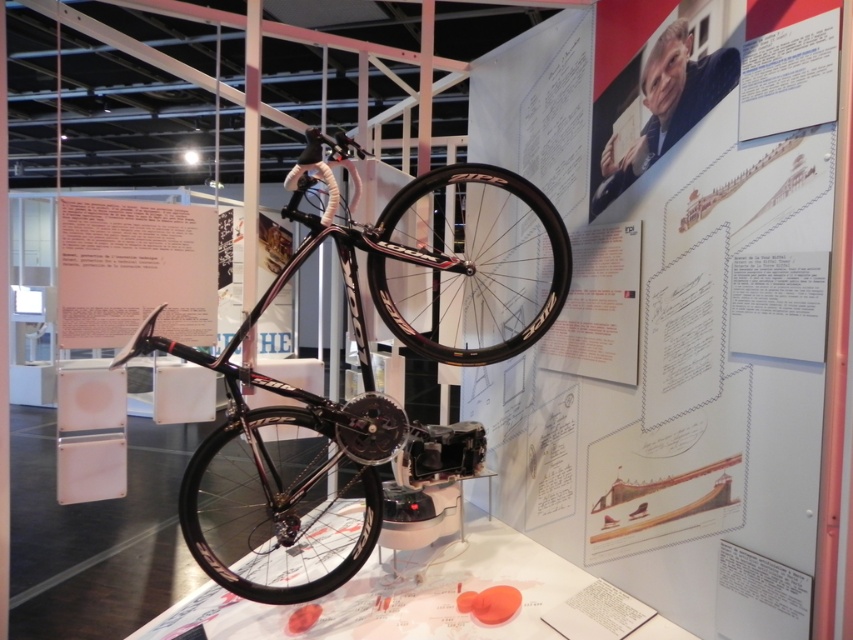
Between point (636, 90) and point (213, 497), which one is positioned in front?

Point (636, 90) is in front.

Can you confirm if white paper poster at upper center is taller than shiny black bicycle at center?

Indeed, white paper poster at upper center has a greater height compared to shiny black bicycle at center.

Who is more distant from viewer, (647, 468) or (277, 433)?

Positioned behind is point (277, 433).

Identify the location of white paper poster at upper center. The height and width of the screenshot is (640, 853). (671, 312).

Can you confirm if black glossy wheel at center is positioned above white paper at center?

Indeed, black glossy wheel at center is positioned over white paper at center.

From the picture: Which is more to the right, black glossy wheel at center or white paper at center?

black glossy wheel at center is more to the right.

Is point (463, 218) less distant than point (80, 294)?

No, (463, 218) is further to viewer.

Find the location of a particular element. The width and height of the screenshot is (853, 640). black glossy wheel at center is located at coordinates (469, 262).

Which is behind, point (407, 326) or point (291, 499)?

Positioned behind is point (407, 326).

Is black glossy wheel at center wider than black glossy bicycle wheel at center?

In fact, black glossy wheel at center might be narrower than black glossy bicycle wheel at center.

Does point (521, 321) come closer to viewer compared to point (370, 528)?

No, (521, 321) is further to viewer.

Find the location of a particular element. This screenshot has width=853, height=640. black glossy wheel at center is located at coordinates (469, 262).